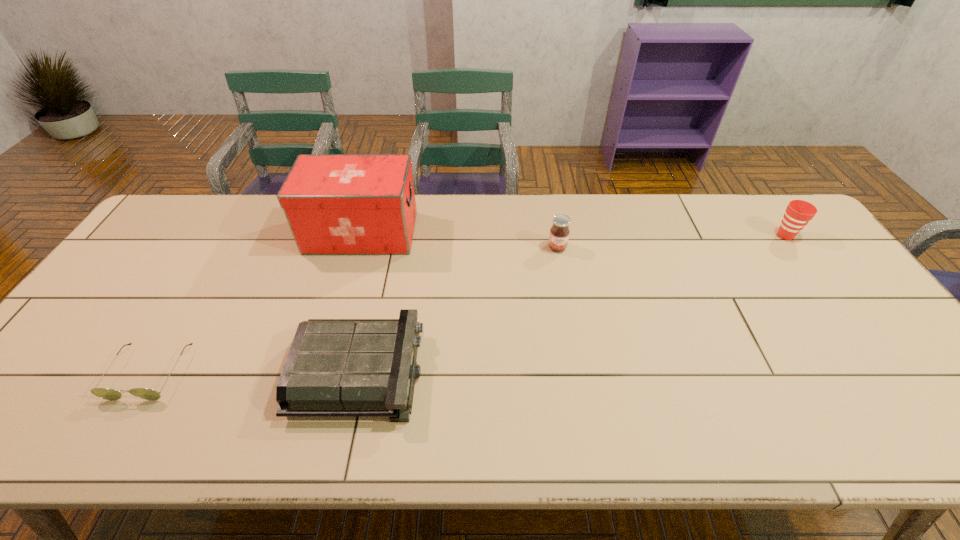
Where is `object that can be found as the third closest to the radio receiver`? This screenshot has width=960, height=540. object that can be found as the third closest to the radio receiver is located at coordinates (559, 234).

Where is `object that can be found as the third closest to the leftmost object`? Image resolution: width=960 pixels, height=540 pixels. object that can be found as the third closest to the leftmost object is located at coordinates (559, 234).

What are the coordinates of `blank space that satisfies the following two spatial constraints: 1. on the front panel of the radio receiver; 2. on the front-facing side of the leftmost object` in the screenshot? It's located at (360, 372).

Where is `vacant position in the image that satisfies the following two spatial constraints: 1. on the label side of the second object from right to left; 2. on the front panel of the second shortest object`? vacant position in the image that satisfies the following two spatial constraints: 1. on the label side of the second object from right to left; 2. on the front panel of the second shortest object is located at coordinates (580, 372).

Where is `vacant space that satisfies the following two spatial constraints: 1. on the handle side of the tallest object; 2. on the right side of the rightmost object`? vacant space that satisfies the following two spatial constraints: 1. on the handle side of the tallest object; 2. on the right side of the rightmost object is located at coordinates (361, 235).

You are a GUI agent. You are given a task and a screenshot of the screen. Output one action in this format:
    pyautogui.click(x=<x>, y=<y>)
    Task: Click on the free space that satisfies the following two spatial constraints: 1. on the label side of the jam; 2. on the front panel of the radio receiver
    The height and width of the screenshot is (540, 960).
    Given the screenshot: What is the action you would take?
    pyautogui.click(x=580, y=372)

At what (x,y) coordinates should I click in order to perform the action: click on vacant area that satisfies the following two spatial constraints: 1. on the handle side of the tallest object; 2. on the right side of the rightmost object. Please return your answer as a coordinate pair (x, y). This screenshot has width=960, height=540. Looking at the image, I should click on (361, 235).